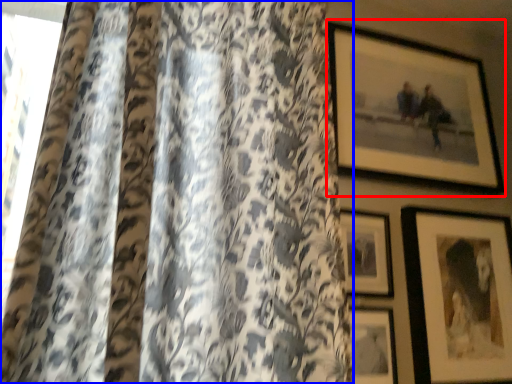
Question: Which object is closer to the camera taking this photo, picture frame (highlighted by a red box) or curtain (highlighted by a blue box)?

Choices:
 (A) picture frame
 (B) curtain

Answer: (B)